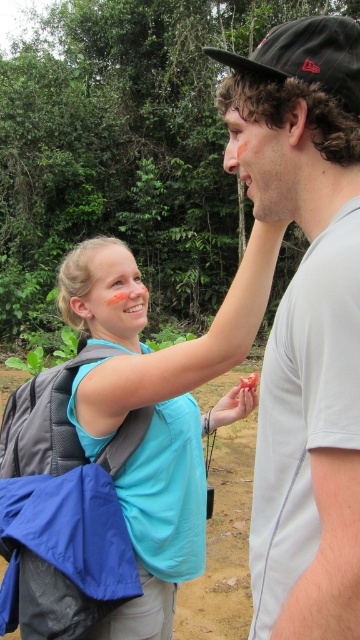
Question: In this image, where is gray cotton t-shirt at center located relative to blue fabric backpack at left?

Choices:
 (A) above
 (B) below

Answer: (A)

Question: Does gray cotton t-shirt at center have a larger size compared to gray fabric backpack at upper left?

Choices:
 (A) yes
 (B) no

Answer: (A)

Question: Which of these objects is positioned farthest from the gray fabric backpack at upper left?

Choices:
 (A) gray cotton t-shirt at center
 (B) blue fabric backpack at left

Answer: (A)

Question: Among these points, which one is farthest from the camera?

Choices:
 (A) (145, 632)
 (B) (5, 621)

Answer: (B)

Question: Which is farther from the gray cotton t-shirt at center?

Choices:
 (A) gray fabric backpack at upper left
 (B) blue fabric backpack at left

Answer: (A)

Question: Can you confirm if gray cotton t-shirt at center is bigger than blue fabric backpack at left?

Choices:
 (A) no
 (B) yes

Answer: (A)